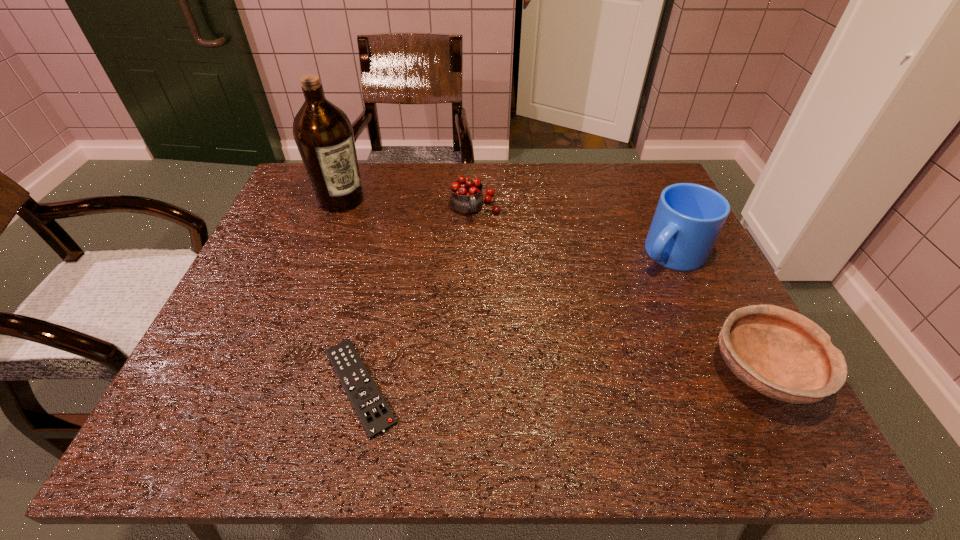
The image size is (960, 540). Find the location of `free spot on the desktop that is between the fourth object from right to left and the bowl and is positioned on the handle side of the pot filled with cherries`. free spot on the desktop that is between the fourth object from right to left and the bowl and is positioned on the handle side of the pot filled with cherries is located at coordinates (543, 380).

The width and height of the screenshot is (960, 540). In order to click on vacant space on the desktop that is between the shortest object and the fourth tallest object and is positioned on the label of the tallest object in this screenshot , I will do `click(530, 380)`.

At what (x,y) coordinates should I click in order to perform the action: click on free space on the desktop that is between the shortest object and the fourth tallest object and is positioned on the side of the third farthest object with the handle. Please return your answer as a coordinate pair (x, y). Image resolution: width=960 pixels, height=540 pixels. Looking at the image, I should click on (538, 380).